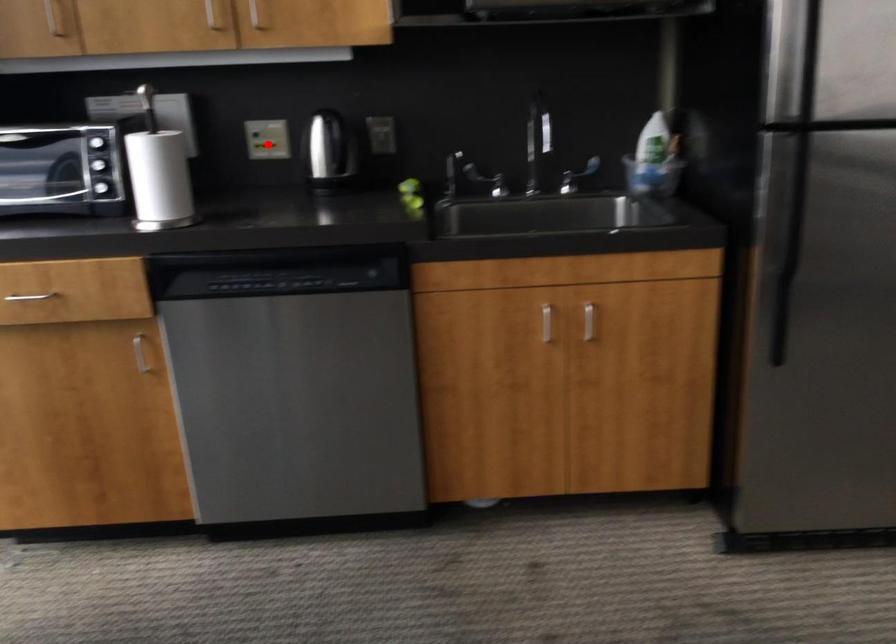
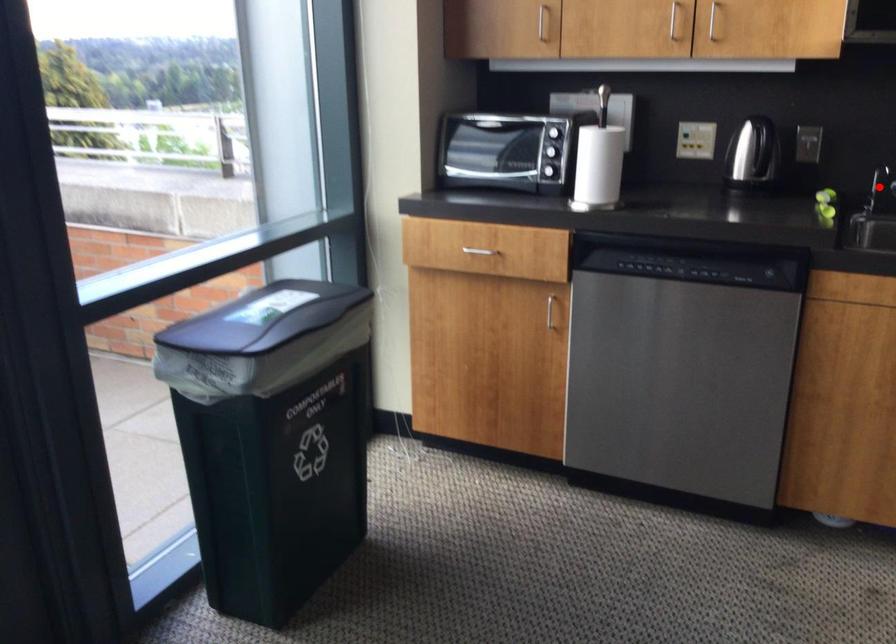
I am providing you with two images of the same scene from different viewpoints. A red point is marked on the first image and another point is marked on the second image. Is the red point in image1 aligned with the point shown in image2?

No